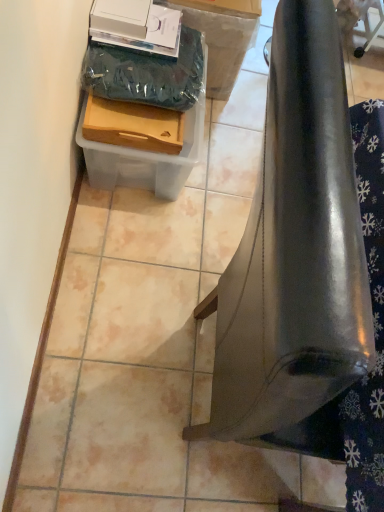
Question: Is wooden tray at lower left, the first box in the front-to-back sequence, spatially inside clear plastic container at lower left, arranged as the first box when viewed from the back, or outside of it?

Choices:
 (A) outside
 (B) inside

Answer: (A)

Question: Considering the positions of wooden tray at lower left, the 2th box viewed from the back, and clear plastic container at lower left, placed as the 2th box when sorted from front to back, in the image, is wooden tray at lower left, the 2th box viewed from the back, wider or thinner than clear plastic container at lower left, placed as the 2th box when sorted from front to back,?

Choices:
 (A) thin
 (B) wide

Answer: (A)

Question: Considering the real-world distances, which object is farthest from the glossy metallic bell at lower right?

Choices:
 (A) clear plastic container at lower left, placed as the 2th box when sorted from front to back
 (B) wooden tray at lower left, the 2th box viewed from the back

Answer: (A)

Question: Which object is positioned closest to the clear plastic container at lower left, placed as the 2th box when sorted from front to back?

Choices:
 (A) glossy metallic bell at lower right
 (B) wooden tray at lower left, the first box in the front-to-back sequence

Answer: (B)